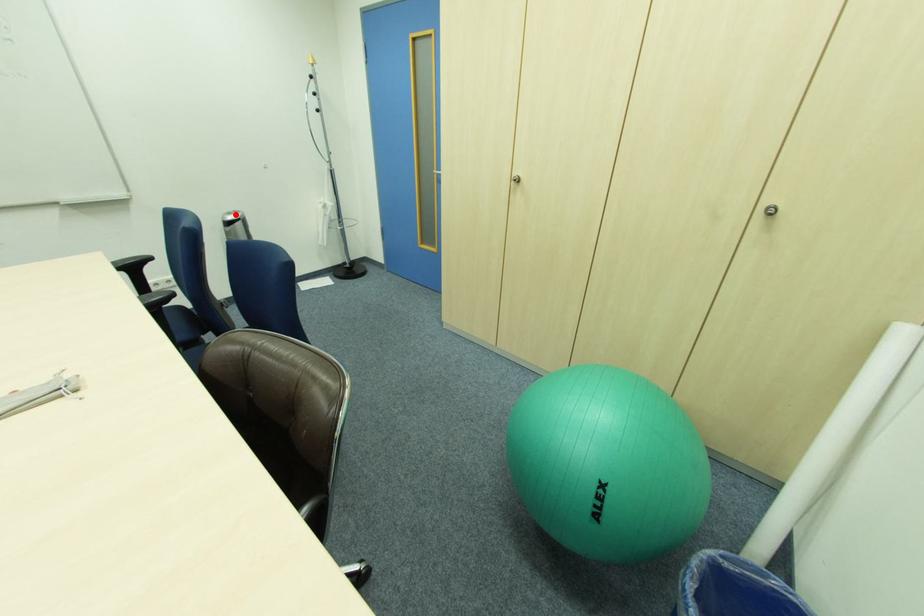
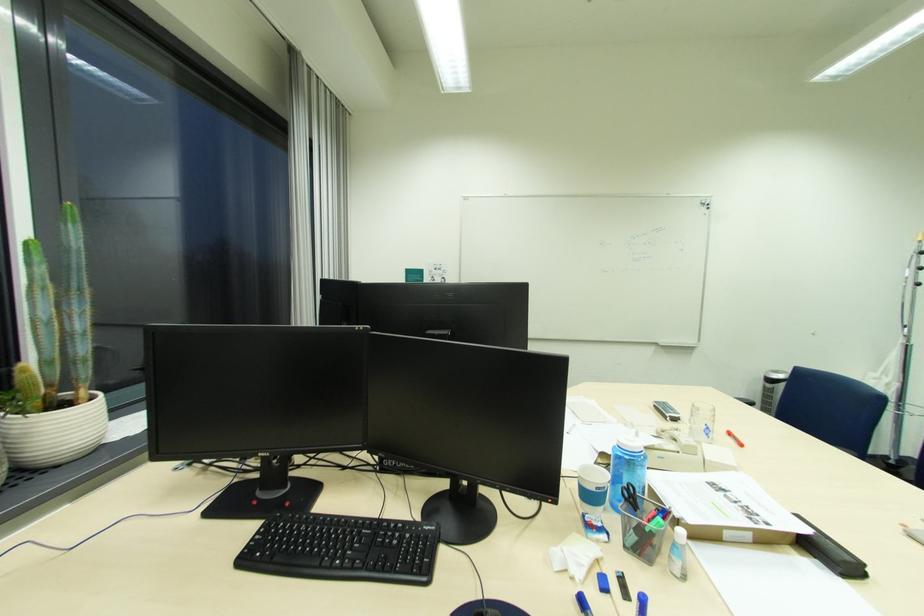
Find the pixel in the second image that matches the highlighted location in the first image.

(782, 373)